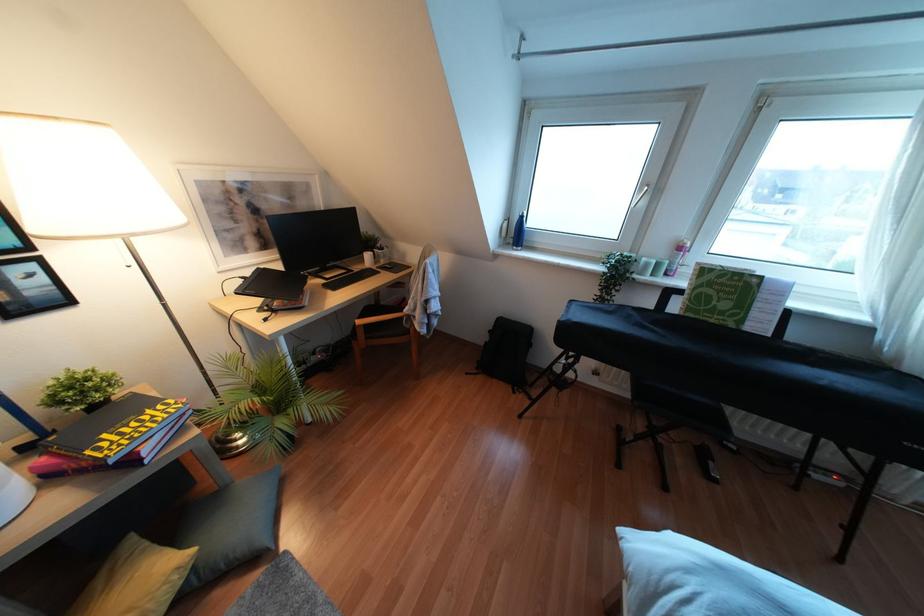
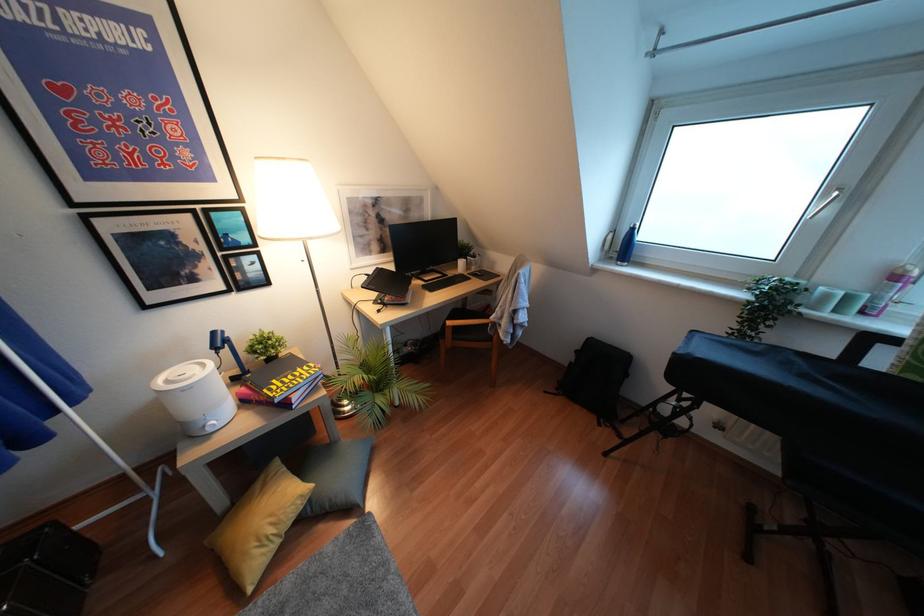
Where in the second image is the point corresponding to (392,265) from the first image?

(481, 274)